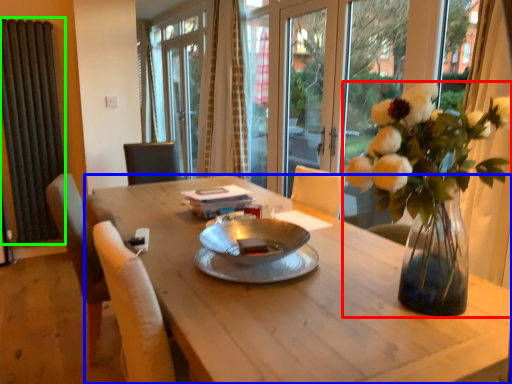
Question: Which is nearer to the houseplant (highlighted by a red box)? desk (highlighted by a blue box) or radiator (highlighted by a green box).

Choices:
 (A) desk
 (B) radiator

Answer: (A)